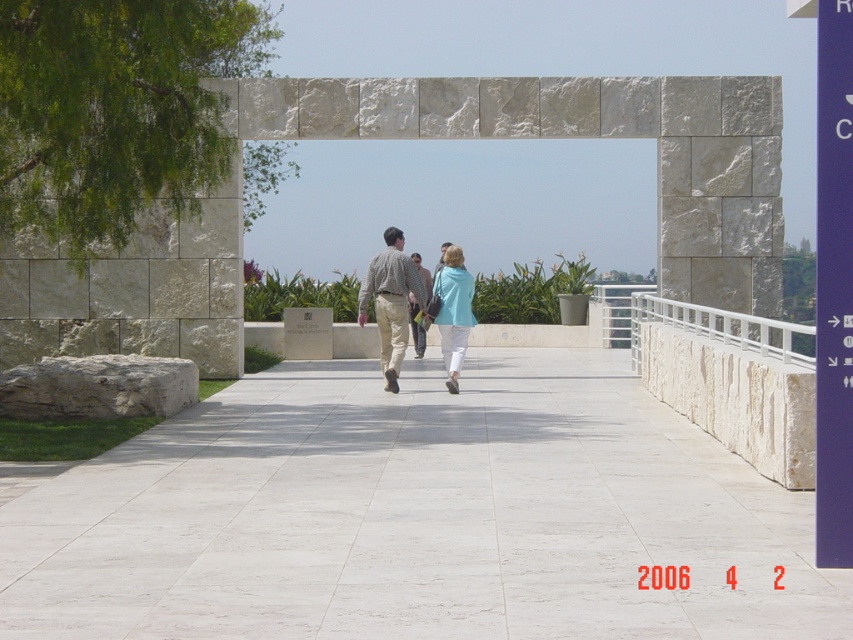
Is matte khaki pants at center below matte blue sweater at center?

Actually, matte khaki pants at center is above matte blue sweater at center.

This screenshot has width=853, height=640. Describe the element at coordinates (392, 275) in the screenshot. I see `matte khaki pants at center` at that location.

Measure the distance between matte khaki pants at center and camera.

matte khaki pants at center is 16.56 meters away from camera.

In order to click on matte khaki pants at center in this screenshot , I will do `click(392, 275)`.

Is matte blue sweater at center bigger than checkered fabric shirt at center?

Incorrect, matte blue sweater at center is not larger than checkered fabric shirt at center.

Is point (466, 300) farther from viewer compared to point (418, 256)?

No, (466, 300) is in front of (418, 256).

What are the coordinates of `matte blue sweater at center` in the screenshot? It's located at click(x=451, y=310).

Can you confirm if checkered fabric shirt at center is thinner than light brown leather jacket at center?

No, checkered fabric shirt at center is not thinner than light brown leather jacket at center.

Can you confirm if checkered fabric shirt at center is shorter than light brown leather jacket at center?

Incorrect, checkered fabric shirt at center's height does not fall short of light brown leather jacket at center's.

Who is more distant from viewer, (418, 324) or (445, 243)?

Positioned behind is point (445, 243).

The height and width of the screenshot is (640, 853). Identify the location of checkered fabric shirt at center. (416, 326).